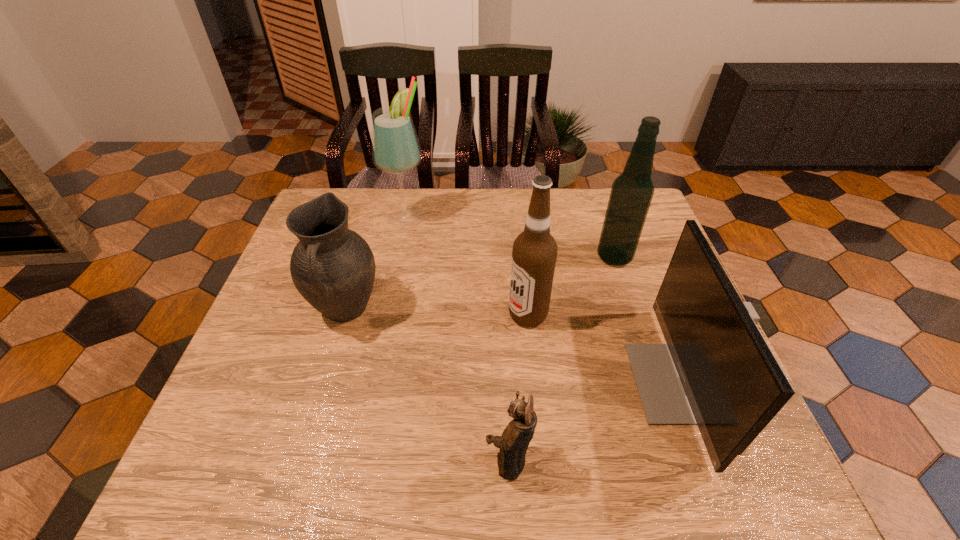
In the image, there is a desktop. Identify the location of free space at the far left corner. The width and height of the screenshot is (960, 540). (353, 218).

This screenshot has width=960, height=540. I want to click on vacant area at the near left corner, so click(201, 461).

Identify the location of free area in between the pitcher and the figurine. The width and height of the screenshot is (960, 540). (426, 386).

The image size is (960, 540). I want to click on free area in between the rightmost alcohol and the farthest alcohol, so (511, 237).

Where is `free spot between the pitcher and the computer monitor`? free spot between the pitcher and the computer monitor is located at coordinates (514, 346).

The width and height of the screenshot is (960, 540). Identify the location of free spot between the computer monitor and the pitcher. (514, 346).

The image size is (960, 540). I want to click on vacant area that lies between the second alcohol from right to left and the computer monitor, so click(605, 349).

At what (x,y) coordinates should I click in order to perform the action: click on vacant space in between the farthest object and the second alcohol from right to left. Please return your answer as a coordinate pair (x, y). Image resolution: width=960 pixels, height=540 pixels. Looking at the image, I should click on (468, 266).

Where is `empty space between the shortest object and the rightmost alcohol`? empty space between the shortest object and the rightmost alcohol is located at coordinates 562,359.

I want to click on free space between the second farthest alcohol and the farthest alcohol, so [x=511, y=237].